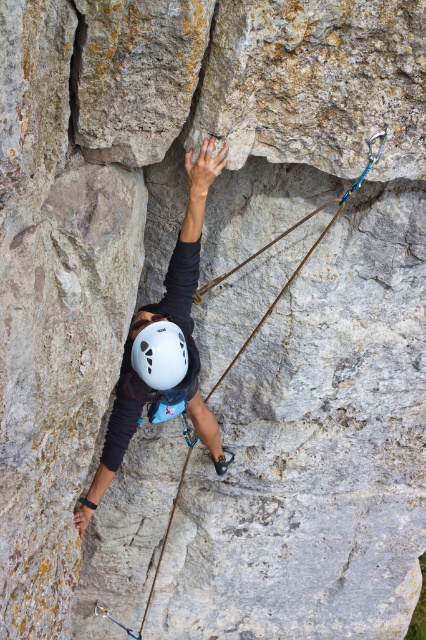
Question: Is matte white helmet at upper center in front of brown rope at center?

Choices:
 (A) no
 (B) yes

Answer: (B)

Question: From the image, what is the correct spatial relationship of matte white helmet at upper center in relation to white matte helmet at center?

Choices:
 (A) right
 (B) left

Answer: (A)

Question: Among these points, which one is farthest from the camera?

Choices:
 (A) (192, 202)
 (B) (161, 378)
 (C) (278, 296)

Answer: (C)

Question: Estimate the real-world distances between objects in this image. Which object is closer to the white matte helmet at center?

Choices:
 (A) matte white helmet at upper center
 (B) brown rope at center

Answer: (A)

Question: Can you confirm if matte white helmet at upper center is bigger than brown rope at center?

Choices:
 (A) yes
 (B) no

Answer: (A)

Question: Which point is farther to the camera?

Choices:
 (A) matte white helmet at upper center
 (B) brown rope at center
 (C) white matte helmet at center

Answer: (B)